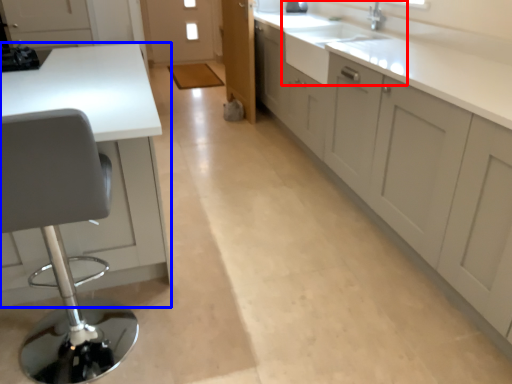
Question: Which point is closer to the camera, sink (highlighted by a red box) or countertop (highlighted by a blue box)?

Choices:
 (A) sink
 (B) countertop

Answer: (B)